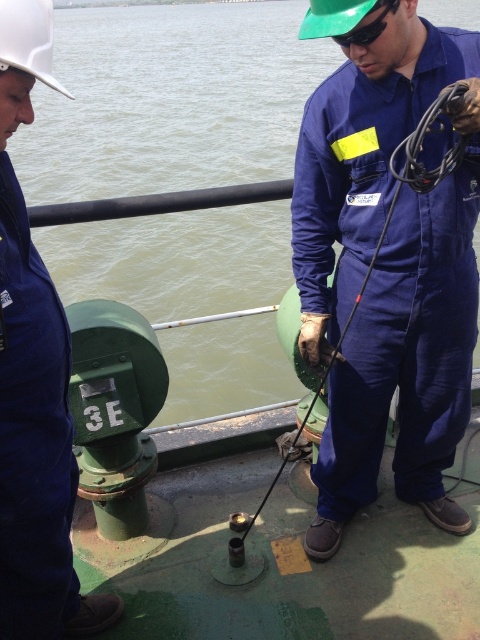
You are a safety inspector on a boat and need to locate the green rubber water at center and the green matte safety goggles at upper center. According to the scene, which object is positioned to the left of the other?

The green rubber water at center is to the left of green matte safety goggles at upper center.

You are a safety inspector on a boat and need to ensure equipment compliance. You observe the green rubber water at center and the green matte safety goggles at upper center. Which object has a greater width according to the provided specifications?

The green rubber water at center has a greater width than the green matte safety goggles at upper center as stated in the description.

You are a safety inspector on the boat and need to check the equipment. Are the green matte safety goggles at upper center placed above the blue fabric jumpsuit at center?

Yes, the green matte safety goggles at upper center are placed above the blue fabric jumpsuit at center as the blue fabric jumpsuit at center is located below green matte safety goggles at upper center.